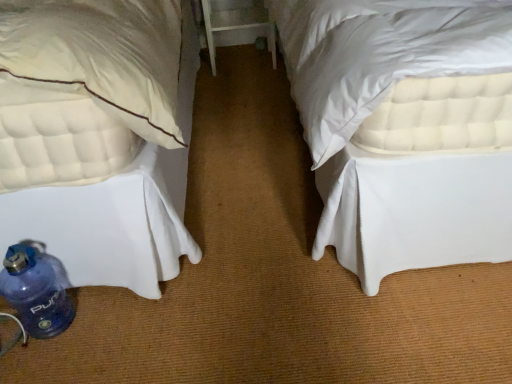
Question: Considering the relative sizes of white quilted mattress at lower left and blue plastic water bottle at lower left in the image provided, is white quilted mattress at lower left shorter than blue plastic water bottle at lower left?

Choices:
 (A) yes
 (B) no

Answer: (B)

Question: From the image's perspective, is white quilted mattress at lower left above blue plastic water bottle at lower left?

Choices:
 (A) no
 (B) yes

Answer: (B)

Question: Can you confirm if white quilted mattress at lower left is thinner than blue plastic water bottle at lower left?

Choices:
 (A) no
 (B) yes

Answer: (A)

Question: Is white quilted mattress at lower left turned away from blue plastic water bottle at lower left?

Choices:
 (A) no
 (B) yes

Answer: (A)

Question: Considering the relative positions of white quilted mattress at lower left and blue plastic water bottle at lower left in the image provided, is white quilted mattress at lower left in front of blue plastic water bottle at lower left?

Choices:
 (A) no
 (B) yes

Answer: (B)

Question: Considering the relative positions of white quilted mattress at lower left and blue plastic water bottle at lower left in the image provided, is white quilted mattress at lower left to the left or to the right of blue plastic water bottle at lower left?

Choices:
 (A) right
 (B) left

Answer: (B)

Question: From a real-world perspective, is white quilted mattress at lower left positioned above or below blue plastic water bottle at lower left?

Choices:
 (A) below
 (B) above

Answer: (B)

Question: Considering the positions of point (155, 192) and point (27, 244), is point (155, 192) closer or farther from the camera than point (27, 244)?

Choices:
 (A) farther
 (B) closer

Answer: (B)

Question: In terms of width, does white quilted mattress at lower left look wider or thinner when compared to blue plastic water bottle at lower left?

Choices:
 (A) thin
 (B) wide

Answer: (B)

Question: From a real-world perspective, is blue plastic water bottle at lower left positioned above or below white quilted mattress at lower left?

Choices:
 (A) above
 (B) below

Answer: (B)

Question: Which is correct: blue plastic water bottle at lower left is inside white quilted mattress at lower left, or outside of it?

Choices:
 (A) inside
 (B) outside

Answer: (A)

Question: Is point (40, 288) positioned closer to the camera than point (111, 220)?

Choices:
 (A) farther
 (B) closer

Answer: (B)

Question: Considering their positions, is blue plastic water bottle at lower left located in front of or behind white quilted mattress at lower left?

Choices:
 (A) front
 (B) behind

Answer: (B)

Question: Is blue plastic water bottle at lower left to the left or to the right of white wood table at center in the image?

Choices:
 (A) left
 (B) right

Answer: (A)

Question: Looking at their shapes, would you say blue plastic water bottle at lower left is wider or thinner than white wood table at center?

Choices:
 (A) thin
 (B) wide

Answer: (A)